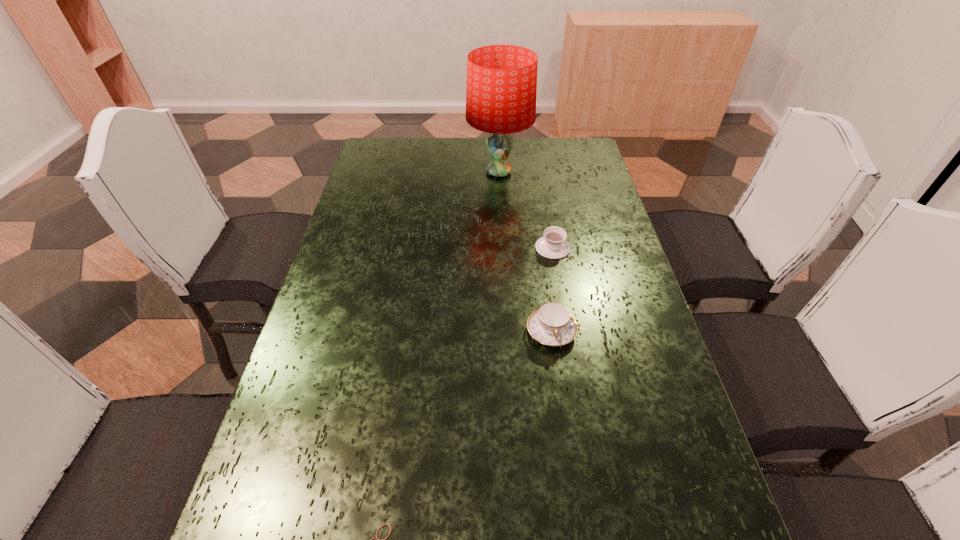
This screenshot has height=540, width=960. In order to click on vacant space that satisfies the following two spatial constraints: 1. on the front-facing side of the tallest object; 2. on the handle side of the shorter teacup in this screenshot , I will do `click(503, 248)`.

This screenshot has width=960, height=540. What are the coordinates of `vacant space that satisfies the following two spatial constraints: 1. on the front-facing side of the lampshade; 2. on the handle side of the shorter teacup` in the screenshot? It's located at (503, 248).